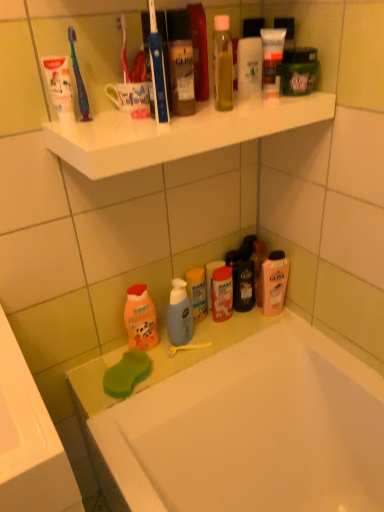
Question: Considering the relative positions of translucent plastic shampoo bottle at lower center, which is the first toiletry in back-to-front order, and matte plastic bottle at center, which is the third toiletry in top-to-bottom order, in the image provided, is translucent plastic shampoo bottle at lower center, which is the first toiletry in back-to-front order, to the left or to the right of matte plastic bottle at center, which is the third toiletry in top-to-bottom order,?

Choices:
 (A) left
 (B) right

Answer: (A)

Question: In terms of width, does translucent plastic shampoo bottle at lower center, which is the 4th toiletry from front to back, look wider or thinner when compared to matte plastic bottle at center, the 2th toiletry positioned from the bottom?

Choices:
 (A) wide
 (B) thin

Answer: (B)

Question: Based on their relative distances, which object is farther from the white matte tube at upper center, positioned as the first toiletry in top-to-bottom order?

Choices:
 (A) white matte toothpaste at upper left
 (B) matte plastic bottle at center, the second toiletry in the back-to-front sequence
 (C) shiny plastic bottle at upper center, the first toiletry positioned from the front
 (D) white glossy bathtub at lower center
 (E) blue plastic toothbrush at upper center, the 2th toothbrush from the left

Answer: (D)

Question: Which object is positioned closest to the blue plastic toothbrush at upper center, the 2th toothbrush from the left?

Choices:
 (A) green sponge at lower left
 (B) pink glossy mouthwash at lower right, positioned as the second mouthwash in top-to-bottom order
 (C) green matte jar at upper right, the second mouthwash in the back-to-front sequence
 (D) white matte tube at upper center, placed as the second toiletry when sorted from front to back
 (E) white glossy shelf at upper center

Answer: (E)